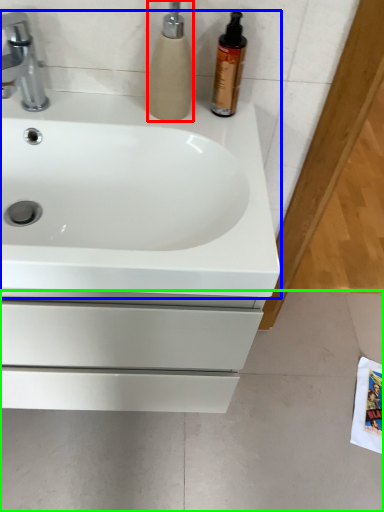
Question: Which object is positioned farthest from soap dispenser (highlighted by a red box)? Select from sink (highlighted by a blue box) and concrete (highlighted by a green box).

Choices:
 (A) sink
 (B) concrete

Answer: (B)